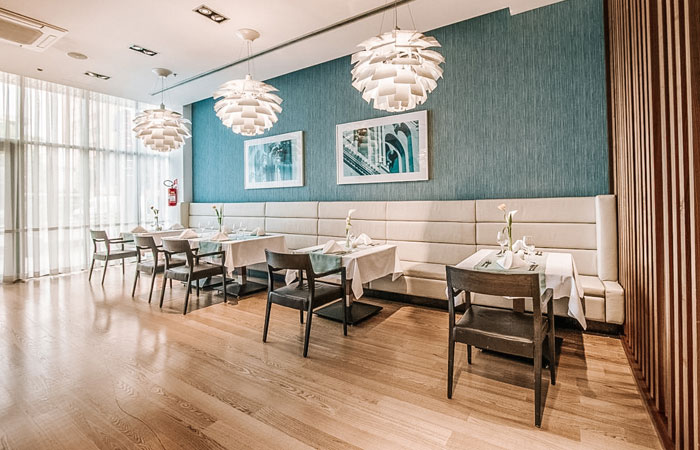
I want to click on tables, so click(526, 260), click(356, 244), click(234, 234), click(187, 231), click(150, 225).